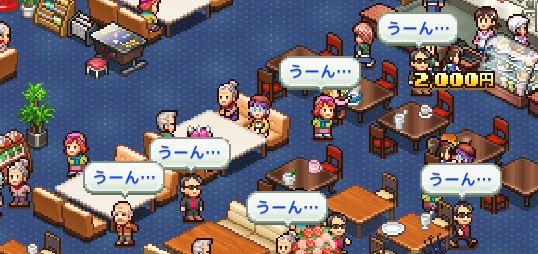
The height and width of the screenshot is (254, 538). I want to click on stool, so click(101, 73).